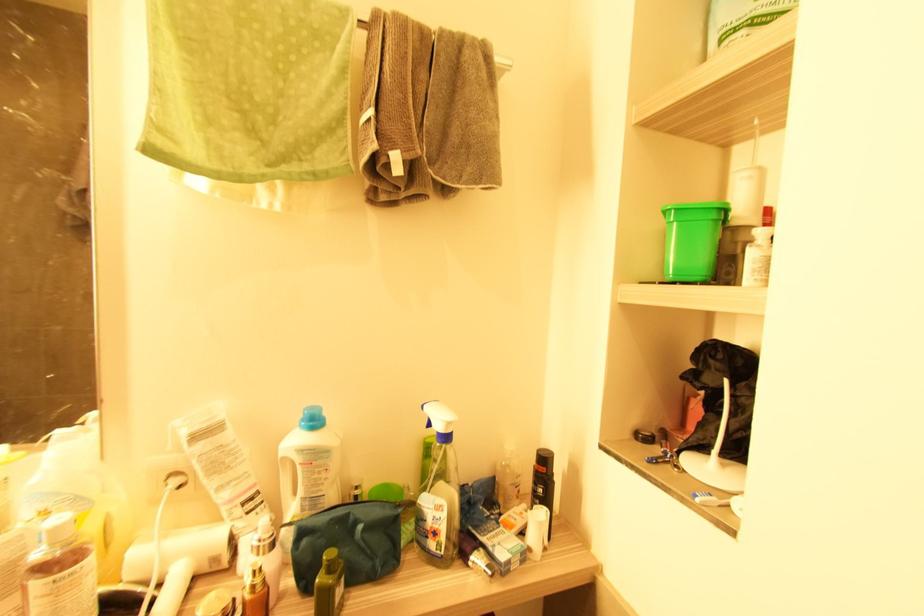
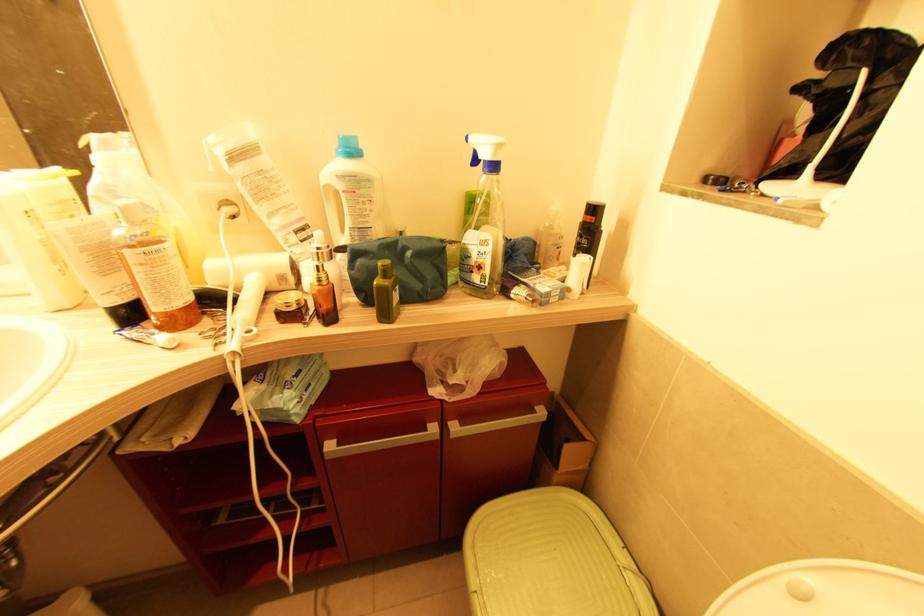
The point at (x=286, y=459) is marked in the first image. Where is the corresponding point in the second image?

(329, 188)